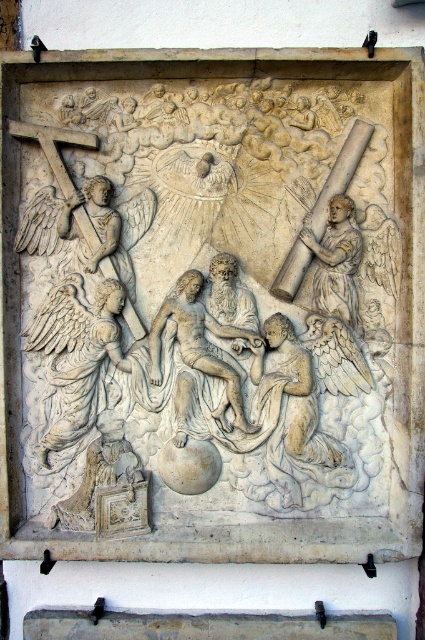
What are the coordinates of the white stone sculpture at center in the image?

The coordinates of the white stone sculpture at center are at point (203,298).

You are an art conservator examining the stone relief sculpture. You need to determine which object is bigger between the white stone sculpture at center and the smooth stone angel at right. Which one is larger?

The white stone sculpture at center has a larger size compared to the smooth stone angel at right, so the white stone sculpture at center is larger.